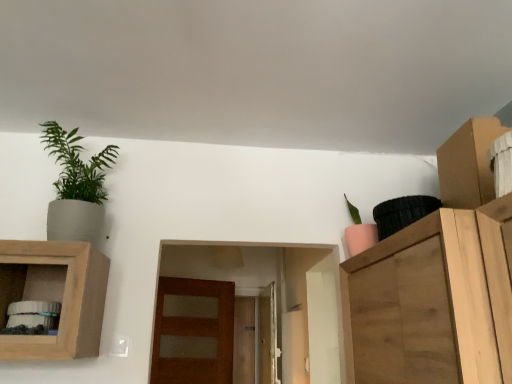
Question: From their relative heights in the image, would you say pink matte pot at upper right, the first houseplant in the right-to-left sequence, is taller or shorter than wooden cabinet at left?

Choices:
 (A) short
 (B) tall

Answer: (A)

Question: Visually, is pink matte pot at upper right, positioned as the second houseplant in left-to-right order, positioned to the left or to the right of wooden cabinet at left?

Choices:
 (A) left
 (B) right

Answer: (B)

Question: Considering the real-world distances, which object is closest to the brown cardboard cabinet at upper right?

Choices:
 (A) pink matte pot at upper right, the first houseplant in the right-to-left sequence
 (B) brown matte door at center
 (C) matte gray pot at upper left, which appears as the 2th houseplant when viewed from the right
 (D) wooden cabinet at left

Answer: (A)

Question: Which of these objects is positioned closest to the pink matte pot at upper right, positioned as the second houseplant in left-to-right order?

Choices:
 (A) brown cardboard cabinet at upper right
 (B) brown matte door at center
 (C) matte gray pot at upper left, arranged as the 1th houseplant when viewed from the left
 (D) wooden cabinet at left

Answer: (A)